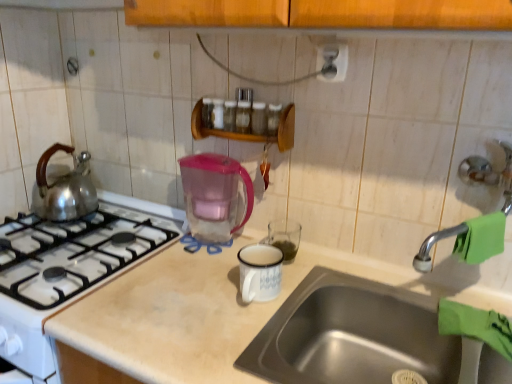
Question: Can you confirm if green rubber faucet at right is wider than wooden spice rack at upper center?

Choices:
 (A) no
 (B) yes

Answer: (A)

Question: Is green rubber faucet at right to the left of wooden spice rack at upper center from the viewer's perspective?

Choices:
 (A) yes
 (B) no

Answer: (B)

Question: Can you confirm if green rubber faucet at right is taller than wooden spice rack at upper center?

Choices:
 (A) no
 (B) yes

Answer: (A)

Question: From the image's perspective, is green rubber faucet at right on wooden spice rack at upper center?

Choices:
 (A) no
 (B) yes

Answer: (A)

Question: Can we say green rubber faucet at right lies outside wooden spice rack at upper center?

Choices:
 (A) no
 (B) yes

Answer: (B)

Question: In terms of size, does green rubber faucet at right appear bigger or smaller than satin silver outlet at upper center?

Choices:
 (A) big
 (B) small

Answer: (A)

Question: Considering their positions, is green rubber faucet at right located in front of or behind satin silver outlet at upper center?

Choices:
 (A) front
 (B) behind

Answer: (A)

Question: In terms of height, does green rubber faucet at right look taller or shorter compared to satin silver outlet at upper center?

Choices:
 (A) short
 (B) tall

Answer: (B)

Question: From the image's perspective, is green rubber faucet at right positioned above or below satin silver outlet at upper center?

Choices:
 (A) below
 (B) above

Answer: (A)

Question: In the image, is satin silver outlet at upper center positioned in front of or behind stainless steel sink at lower right?

Choices:
 (A) behind
 (B) front

Answer: (A)

Question: From a real-world perspective, is satin silver outlet at upper center positioned above or below stainless steel sink at lower right?

Choices:
 (A) above
 (B) below

Answer: (A)

Question: Considering the positions of point (330, 76) and point (437, 329), is point (330, 76) closer or farther from the camera than point (437, 329)?

Choices:
 (A) closer
 (B) farther

Answer: (B)

Question: Looking at their shapes, would you say satin silver outlet at upper center is wider or thinner than stainless steel sink at lower right?

Choices:
 (A) wide
 (B) thin

Answer: (B)

Question: From the image's perspective, is stainless steel sink at lower right positioned above or below transparent plastic pitcher at center?

Choices:
 (A) above
 (B) below

Answer: (B)

Question: From a real-world perspective, is stainless steel sink at lower right physically located above or below transparent plastic pitcher at center?

Choices:
 (A) below
 (B) above

Answer: (A)